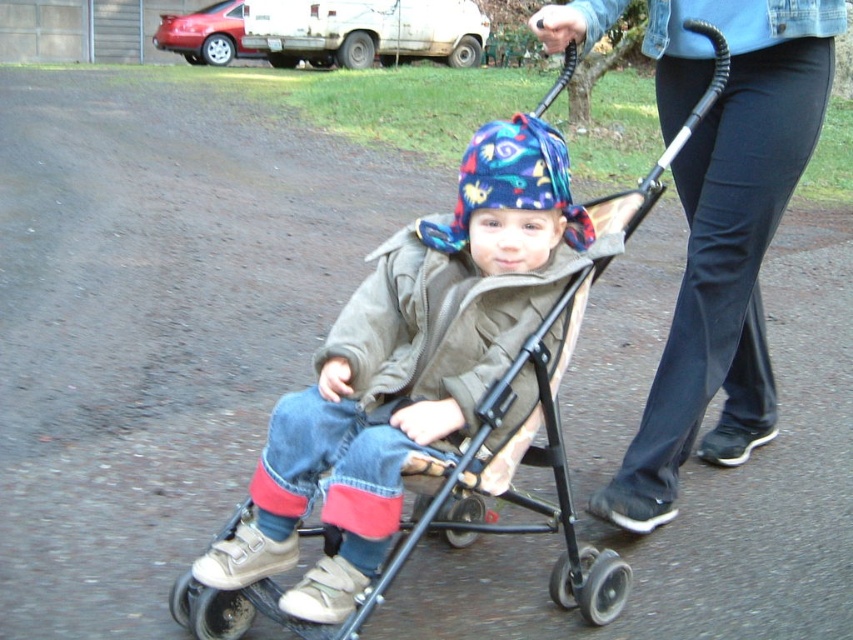
Locate an element on the screen. The width and height of the screenshot is (853, 640). metallic stroller at center is located at coordinates (409, 554).

Is metallic stroller at center to the left of multicolored fabric hat at center from the viewer's perspective?

In fact, metallic stroller at center is to the right of multicolored fabric hat at center.

This screenshot has height=640, width=853. What do you see at coordinates (409, 554) in the screenshot?
I see `metallic stroller at center` at bounding box center [409, 554].

Where is `metallic stroller at center`? This screenshot has width=853, height=640. metallic stroller at center is located at coordinates (409, 554).

You are a GUI agent. You are given a task and a screenshot of the screen. Output one action in this format:
    pyautogui.click(x=<x>, y=<y>)
    Task: Click on the denim pants at center
    This screenshot has width=853, height=640.
    Given the screenshot: What is the action you would take?
    pyautogui.click(x=723, y=230)

Does denim pants at center have a larger size compared to multicolored fabric hat at center?

Yes.

Does point (753, 211) come behind point (573, 240)?

That is True.

Find the location of a particular element. Image resolution: width=853 pixels, height=640 pixels. denim pants at center is located at coordinates (723, 230).

The height and width of the screenshot is (640, 853). Identify the location of denim pants at center. (723, 230).

Can you confirm if denim pants at center is shorter than metallic stroller at center?

In fact, denim pants at center may be taller than metallic stroller at center.

Identify the location of denim pants at center. The width and height of the screenshot is (853, 640). (723, 230).

The width and height of the screenshot is (853, 640). I want to click on denim pants at center, so click(x=723, y=230).